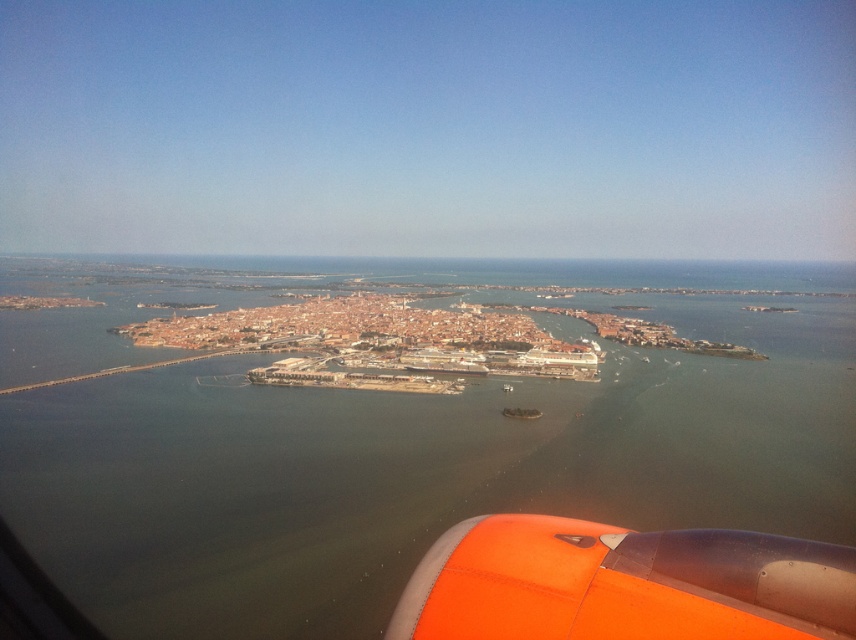
Is brown water at center further to the viewer compared to metallic silver boat at center?

That is False.

Who is positioned more to the left, brown water at center or metallic silver boat at center?

Positioned to the left is brown water at center.

Locate an element on the screen. The image size is (856, 640). brown water at center is located at coordinates [395, 436].

Is orange matte engine at lower right shorter than metallic silver boat at center?

Incorrect, orange matte engine at lower right's height does not fall short of metallic silver boat at center's.

Who is more distant from viewer, (474,518) or (516,416)?

Point (516,416)

Image resolution: width=856 pixels, height=640 pixels. In order to click on orange matte engine at lower right in this screenshot , I will do `click(623, 582)`.

Locate an element on the screen. orange matte engine at lower right is located at coordinates (623, 582).

Which is behind, point (168, 541) or point (846, 586)?

The point (168, 541) is behind.

Find the location of a particular element. brown water at center is located at coordinates (395, 436).

Is point (284, 612) positioned in front of point (746, 584)?

No, (284, 612) is further to viewer.

The height and width of the screenshot is (640, 856). I want to click on brown water at center, so click(x=395, y=436).